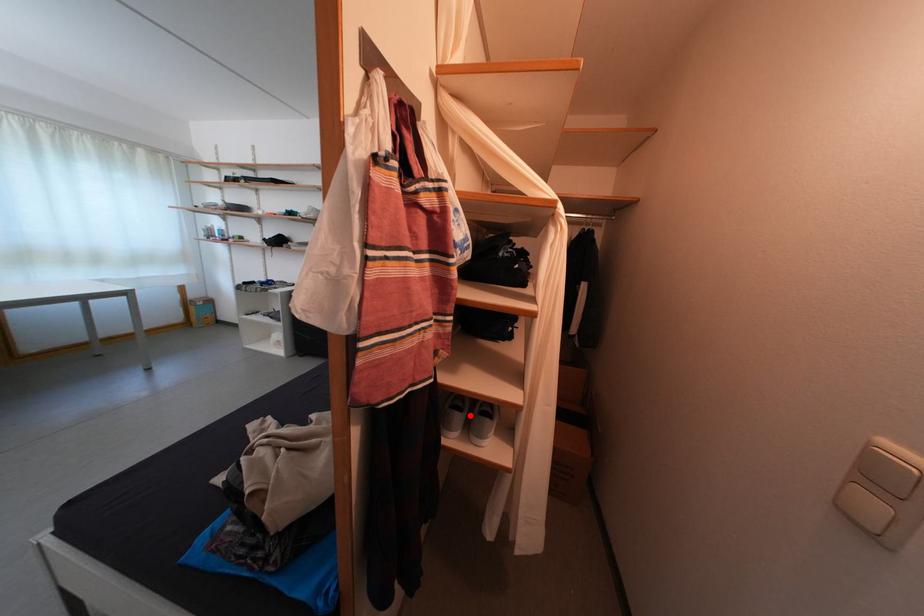
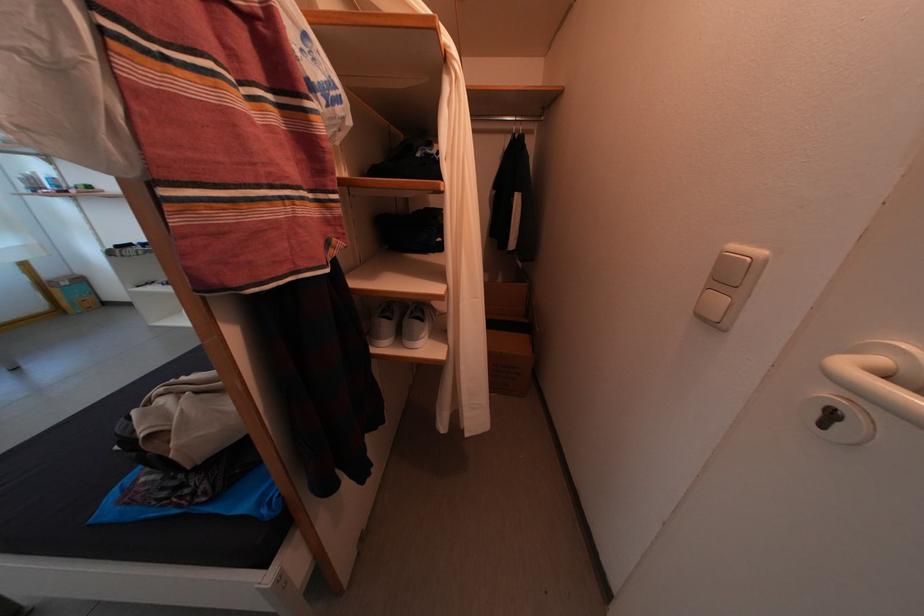
Question: I am providing you with two images of the same scene from different viewpoints. Given a red point in image1, look at the same physical point in image2. Is it:

Choices:
 (A) Closer to the viewpoint
 (B) Farther from the viewpoint

Answer: (A)